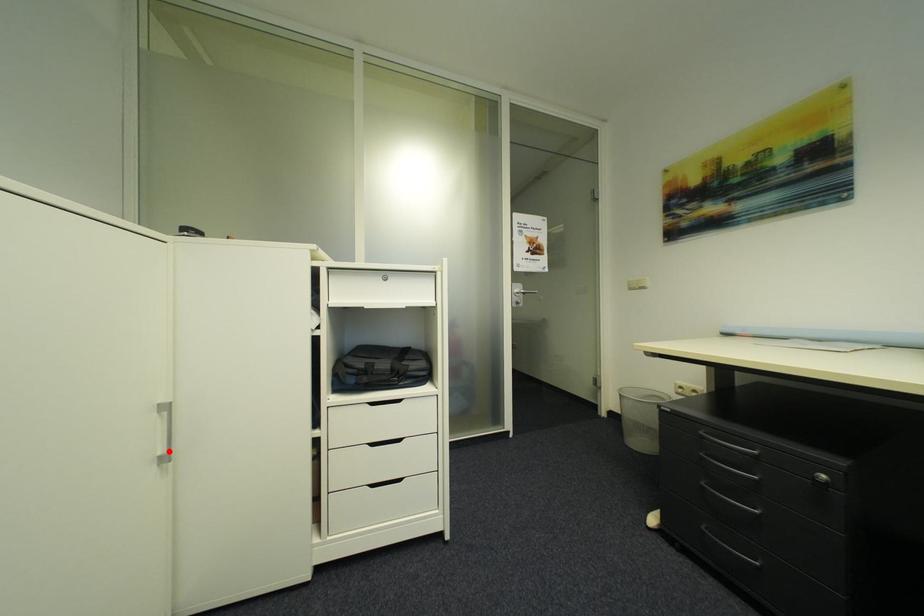
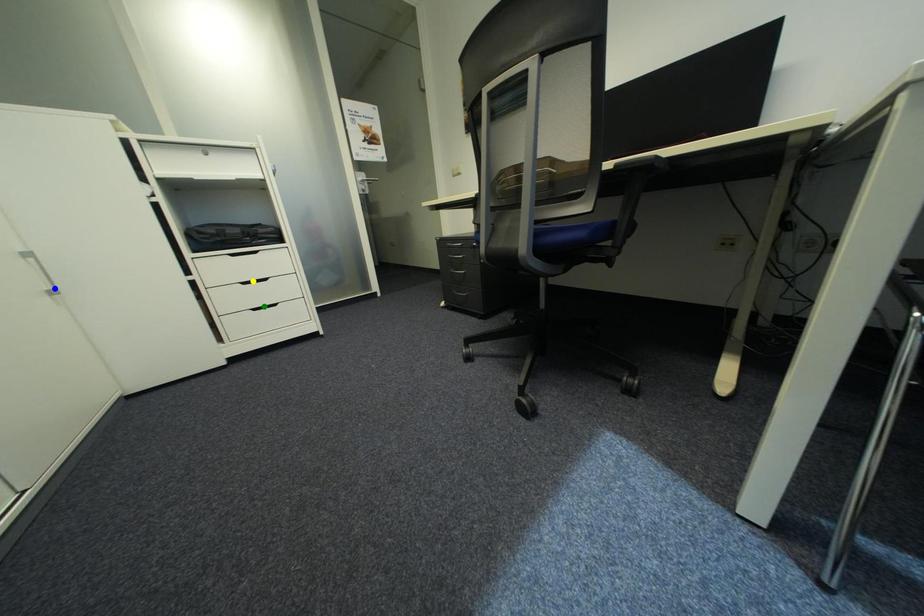
Question: I am providing you with two images of the same scene from different viewpoints. A red point is marked on the first image. You are given multiple points on the second image. In image 2, which mark is for the same physical point as the one in image 1?

Choices:
 (A) blue point
 (B) green point
 (C) yellow point

Answer: (A)